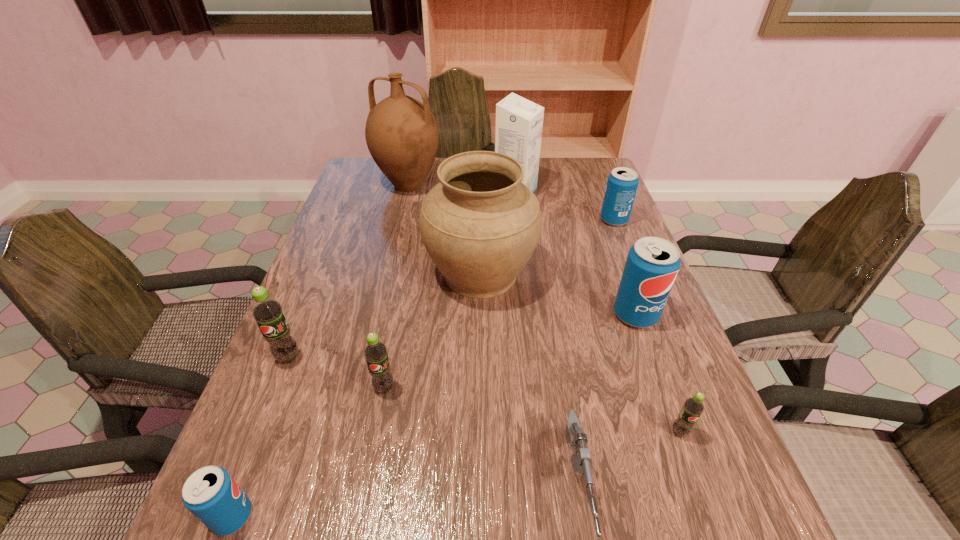
The height and width of the screenshot is (540, 960). Identify the location of object that is at the near left corner. 211,494.

The width and height of the screenshot is (960, 540). I want to click on free space at the right edge, so click(616, 269).

Where is `empty space that is in between the nearest blue soda can and the farthest green soda`? empty space that is in between the nearest blue soda can and the farthest green soda is located at coordinates (260, 437).

What are the coordinates of `vacant point located between the smallest green soda and the second biggest green soda` in the screenshot? It's located at (532, 410).

Where is `free space that is in between the smallest green soda and the urn`? free space that is in between the smallest green soda and the urn is located at coordinates (580, 353).

Image resolution: width=960 pixels, height=540 pixels. I want to click on free spot between the carton and the eighth nearest object, so click(x=564, y=206).

You are a GUI agent. You are given a task and a screenshot of the screen. Output one action in this format:
    pyautogui.click(x=<x>, y=<y>)
    Task: Click on the vacant space in between the smallest blue soda can and the nearest green soda
    The height and width of the screenshot is (540, 960).
    Given the screenshot: What is the action you would take?
    pyautogui.click(x=456, y=474)

Identify the location of free space between the urn and the fifth nearest soda can. The image size is (960, 540). (558, 294).

You are a GUI agent. You are given a task and a screenshot of the screen. Output one action in this format:
    pyautogui.click(x=<x>, y=<y>)
    Task: Click on the free space that is in between the second green soda from left to right and the smallest blue soda can
    
    Given the screenshot: What is the action you would take?
    pyautogui.click(x=308, y=452)

Identify which object is located as the third nearest to the pitcher. Please provide its 2D coordinates. Your answer should be formatted as a tuple, i.e. [(x, y)], where the tuple contains the x and y coordinates of a point satisfying the conditions above.

[(622, 184)]